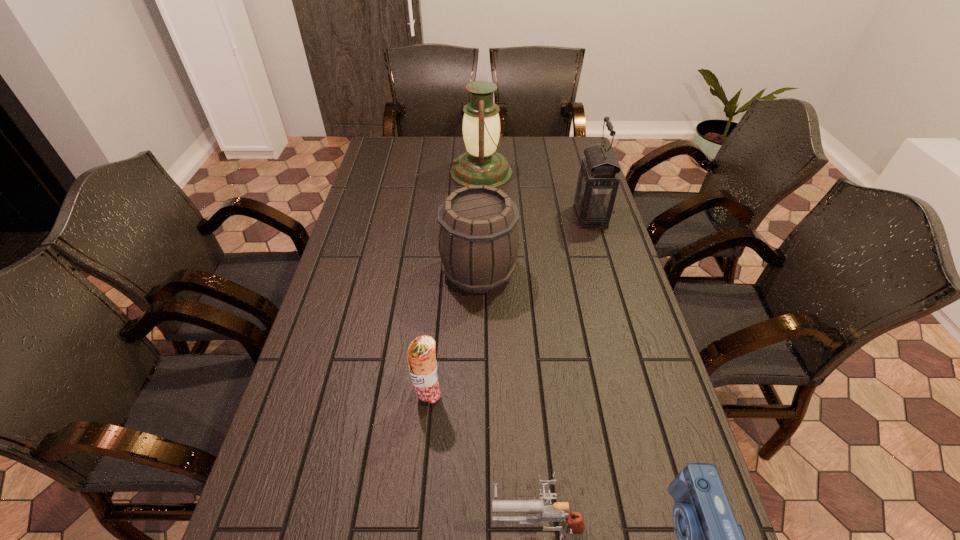
Find the location of `free location located 0.250m with the light compartment facing forward on the left lantern`. free location located 0.250m with the light compartment facing forward on the left lantern is located at coordinates (387, 173).

Where is `free location located 0.260m on the front-facing side of the right lantern`? free location located 0.260m on the front-facing side of the right lantern is located at coordinates (500, 217).

Find the location of a particular element. vacant space located 0.100m on the front-facing side of the right lantern is located at coordinates [545, 217].

Image resolution: width=960 pixels, height=540 pixels. I want to click on vacant region located 0.240m on the front-facing side of the right lantern, so (x=505, y=217).

At what (x,y) coordinates should I click in order to perform the action: click on blank area located on the front of the third farthest object. Please return your answer as a coordinate pair (x, y). The height and width of the screenshot is (540, 960). Looking at the image, I should click on [478, 408].

This screenshot has height=540, width=960. Find the location of `free space located 0.100m on the back of the fourth tallest object`. free space located 0.100m on the back of the fourth tallest object is located at coordinates (432, 351).

Locate an element on the screen. object that is positioned at the far edge is located at coordinates click(x=481, y=164).

The height and width of the screenshot is (540, 960). In order to click on object situated at the right edge in this screenshot , I will do `click(598, 180)`.

Locate an element on the screen. vacant space at the far edge of the desktop is located at coordinates (450, 164).

Find the location of a particular element. The height and width of the screenshot is (540, 960). vacant space at the left edge is located at coordinates (340, 266).